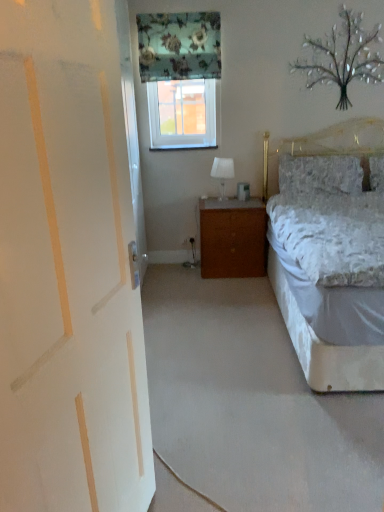
Question: Is floral fabric curtain at upper center positioned before white painted wood door at left?

Choices:
 (A) yes
 (B) no

Answer: (B)

Question: Is floral fabric curtain at upper center facing towards white painted wood door at left?

Choices:
 (A) yes
 (B) no

Answer: (A)

Question: From a real-world perspective, is floral fabric curtain at upper center beneath white painted wood door at left?

Choices:
 (A) no
 (B) yes

Answer: (A)

Question: Does floral fabric curtain at upper center appear on the left side of white painted wood door at left?

Choices:
 (A) no
 (B) yes

Answer: (A)

Question: Can you confirm if floral fabric curtain at upper center is wider than white painted wood door at left?

Choices:
 (A) yes
 (B) no

Answer: (B)

Question: Is fluffy white pillow at right in front of or behind white painted wood door at left in the image?

Choices:
 (A) behind
 (B) front

Answer: (A)

Question: Would you say fluffy white pillow at right is inside or outside white painted wood door at left?

Choices:
 (A) outside
 (B) inside

Answer: (A)

Question: Is fluffy white pillow at right to the left or to the right of white painted wood door at left in the image?

Choices:
 (A) left
 (B) right

Answer: (B)

Question: Is fluffy white pillow at right taller or shorter than white painted wood door at left?

Choices:
 (A) short
 (B) tall

Answer: (A)

Question: Choose the correct answer: Is clear glass window at upper center inside brown wood nightstand at center or outside it?

Choices:
 (A) outside
 (B) inside

Answer: (A)

Question: Is clear glass window at upper center to the left or to the right of brown wood nightstand at center in the image?

Choices:
 (A) left
 (B) right

Answer: (A)

Question: From a real-world perspective, is clear glass window at upper center above or below brown wood nightstand at center?

Choices:
 (A) above
 (B) below

Answer: (A)

Question: Considering their positions, is clear glass window at upper center located in front of or behind brown wood nightstand at center?

Choices:
 (A) front
 (B) behind

Answer: (B)

Question: From a real-world perspective, is white glossy table lamp at center positioned above or below clear glass window at upper center?

Choices:
 (A) above
 (B) below

Answer: (B)

Question: Would you say white glossy table lamp at center is inside or outside clear glass window at upper center?

Choices:
 (A) outside
 (B) inside

Answer: (A)